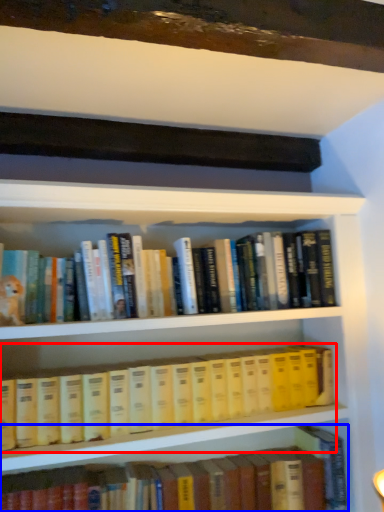
Question: Which of the following is the closest to the observer, book (highlighted by a red box) or book (highlighted by a blue box)?

Choices:
 (A) book
 (B) book

Answer: (A)